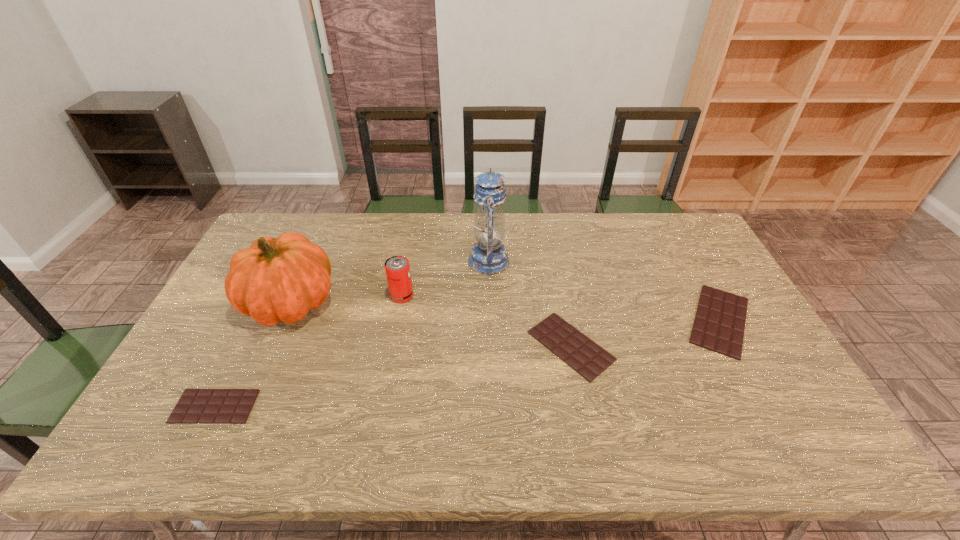
The height and width of the screenshot is (540, 960). In order to click on free space between the second tallest chocolate bar and the tallest object in this screenshot , I will do `click(530, 303)`.

The height and width of the screenshot is (540, 960). I want to click on vacant area that lies between the tallest object and the nearest chocolate bar, so click(x=351, y=334).

At what (x,y) coordinates should I click in order to perform the action: click on free space between the third object from left to right and the fifth shortest object. Please return your answer as a coordinate pair (x, y). Looking at the image, I should click on 347,299.

Locate an element on the screen. This screenshot has height=540, width=960. free area in between the fourth object from right to left and the second tallest object is located at coordinates pos(347,299).

What are the coordinates of `empty space between the rightmost chocolate bar and the second tallest chocolate bar` in the screenshot? It's located at (645, 333).

The image size is (960, 540). Find the location of `vacant space that is in between the lantern and the second shortest object`. vacant space that is in between the lantern and the second shortest object is located at coordinates (530, 303).

The height and width of the screenshot is (540, 960). In order to click on unoccupied area between the third object from left to right and the fifth tallest object in this screenshot , I will do `click(487, 321)`.

In order to click on unoccupied area between the shortest object and the fourth object from left to right in this screenshot , I will do `click(351, 334)`.

You are a GUI agent. You are given a task and a screenshot of the screen. Output one action in this format:
    pyautogui.click(x=<x>, y=<y>)
    Task: Click on the vacant area that lies between the third object from right to left and the fourth object from right to left
    
    Given the screenshot: What is the action you would take?
    pyautogui.click(x=445, y=278)

Identify which object is located as the third nearest to the third object from left to right. Please provide its 2D coordinates. Your answer should be formatted as a tuple, i.e. [(x, y)], where the tuple contains the x and y coordinates of a point satisfying the conditions above.

[(583, 355)]